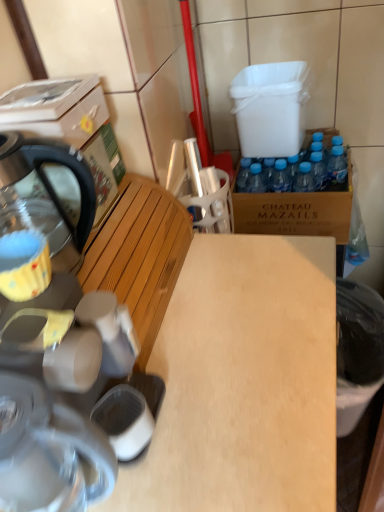
Where is `free space to the right of wooden bench at left`? free space to the right of wooden bench at left is located at coordinates (247, 288).